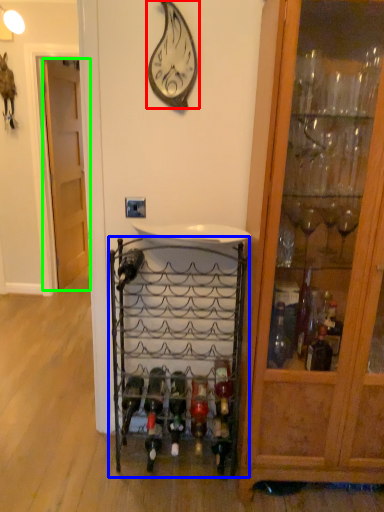
Question: Which is nearer to the wall clock (highlighted by a red box)? shelf (highlighted by a blue box) or door (highlighted by a green box).

Choices:
 (A) shelf
 (B) door

Answer: (A)